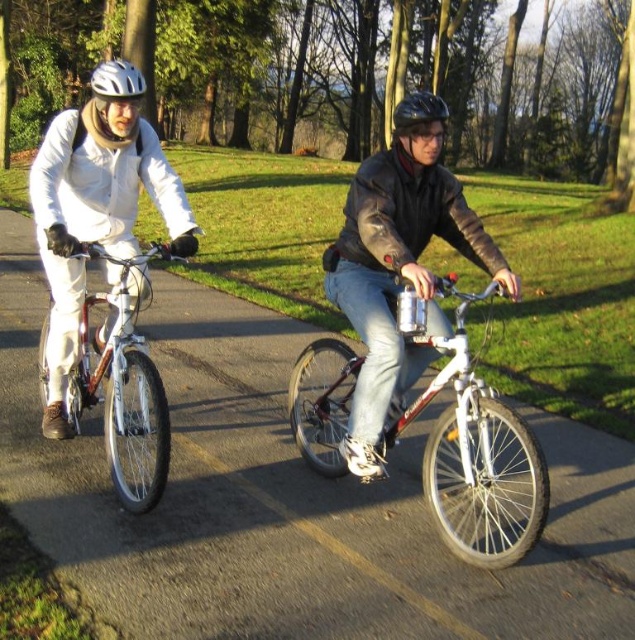
You are a photographer standing at the edge of the park path. You want to take a photo of both the metallic silver bicycle at center and the white matte helmet at upper left. Which object should you focus on first to ensure it appears sharp in the photo?

You should focus on the metallic silver bicycle at center first because it is closer to the viewer than the white matte helmet at upper left, so focusing on the closer object ensures it will be sharp, while the helmet might be slightly out of focus if the depth of field is limited.

You are a photographer trying to capture a clear shot of both the shiny metallic bicycle at left and the white matte helmet at upper left. Since you can only focus on one object at a time, which one should you choose to ensure it appears sharp in the photo?

You should focus on the shiny metallic bicycle at left because it is closer to the viewer than the white matte helmet at upper left, making it easier to capture in focus.